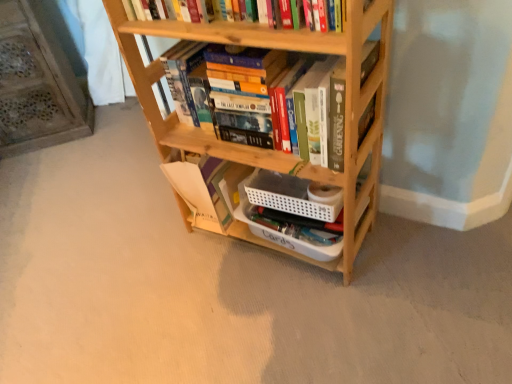
Image resolution: width=512 pixels, height=384 pixels. Identify the location of blank area to the left of natural wood bookcase at center. (158, 265).